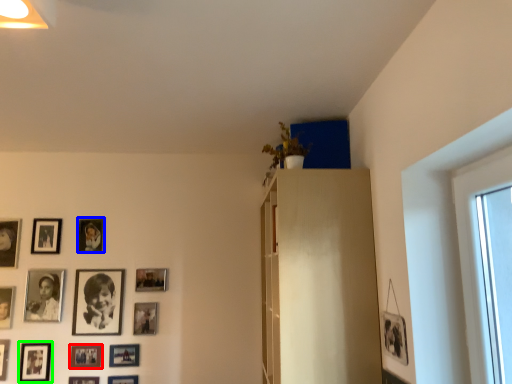
Question: Considering the real-world distances, which object is closest to picture frame (highlighted by a red box)? picture frame (highlighted by a blue box) or picture frame (highlighted by a green box).

Choices:
 (A) picture frame
 (B) picture frame

Answer: (B)